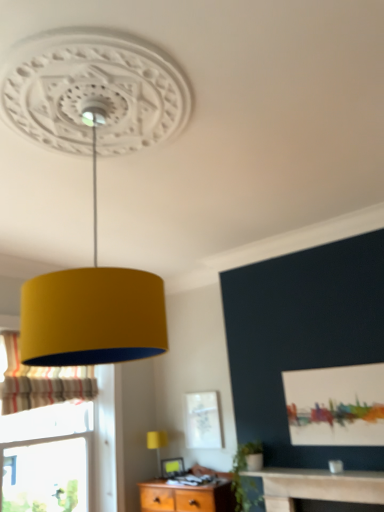
Question: From a real-world perspective, is matte yellow lampshade at lower center physically located above or below matte white picture frame at lower center?

Choices:
 (A) above
 (B) below

Answer: (A)

Question: Is matte yellow lampshade at lower center bigger or smaller than matte white picture frame at lower center?

Choices:
 (A) small
 (B) big

Answer: (B)

Question: Estimate the real-world distances between objects in this image. Which object is closer to the striped fabric curtain at left?

Choices:
 (A) matte white picture frame at lower center
 (B) matte yellow lampshade at lower center

Answer: (B)

Question: Considering the real-world distances, which object is closest to the matte white picture frame at lower center?

Choices:
 (A) striped fabric curtain at left
 (B) matte yellow lampshade at lower center

Answer: (B)